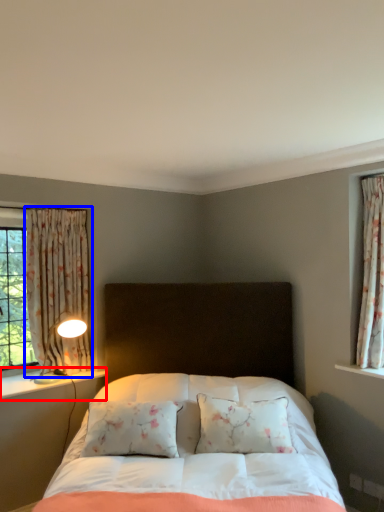
Question: Which point is closer to the camera, window sill (highlighted by a red box) or curtain (highlighted by a blue box)?

Choices:
 (A) window sill
 (B) curtain

Answer: (A)